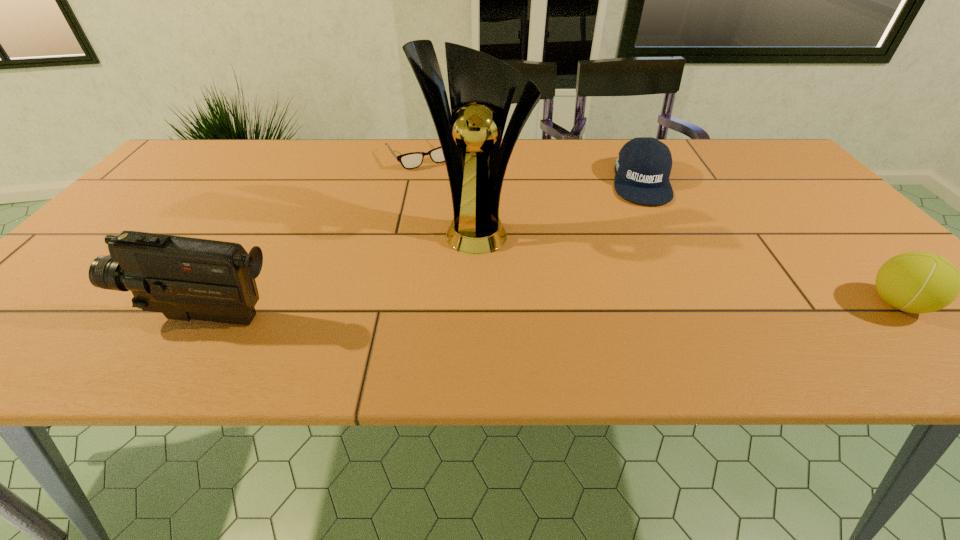
Locate an element on the screen. This screenshot has width=960, height=540. free space at the near right corner of the desktop is located at coordinates (936, 312).

This screenshot has height=540, width=960. I want to click on vacant area that lies between the tennis ball and the second object from right to left, so click(769, 242).

Locate an element on the screen. unoccupied area between the camcorder and the baseball cap is located at coordinates (424, 249).

This screenshot has width=960, height=540. I want to click on vacant area that lies between the shortest object and the award, so click(x=447, y=192).

At what (x,y) coordinates should I click in order to perform the action: click on free area in between the rightmost object and the award. Please return your answer as a coordinate pair (x, y). This screenshot has width=960, height=540. Looking at the image, I should click on (x=686, y=266).

This screenshot has width=960, height=540. I want to click on free space between the tallest object and the camcorder, so click(x=342, y=273).

The image size is (960, 540). Identify the location of empty space that is in between the spectacles and the fourth shortest object. pos(314,236).

The image size is (960, 540). I want to click on vacant point located between the tennis ball and the fourth object from left to right, so click(769, 242).

The width and height of the screenshot is (960, 540). What are the coordinates of `vacant area between the tennis ball and the second tallest object` in the screenshot? It's located at (553, 310).

Image resolution: width=960 pixels, height=540 pixels. I want to click on empty location between the award and the shortest object, so click(x=447, y=192).